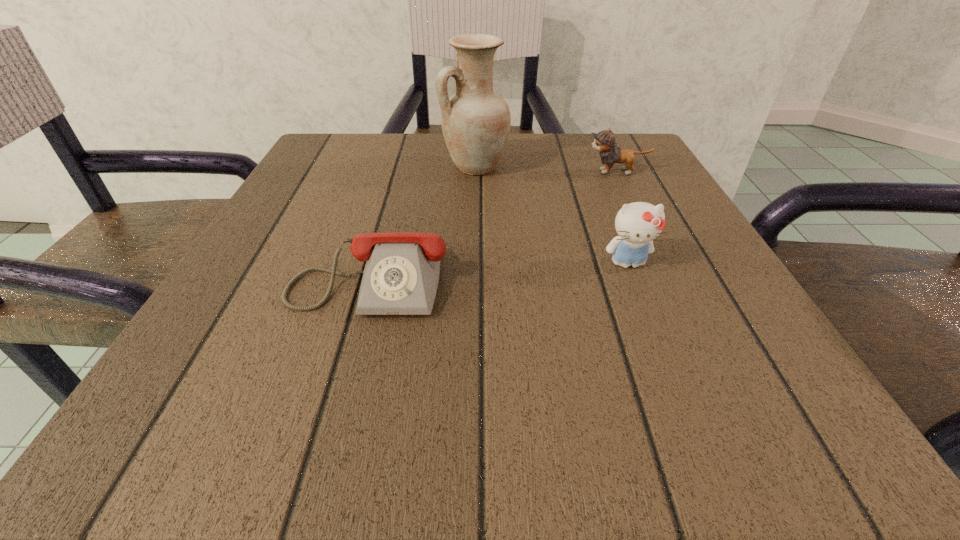
Locate an element on the screen. This screenshot has height=540, width=960. blank space located 0.400m on the front-facing side of the shorter kitten is located at coordinates (388, 172).

Image resolution: width=960 pixels, height=540 pixels. I want to click on pottery present at the far edge, so click(x=475, y=121).

At what (x,y) coordinates should I click in order to perform the action: click on kitten located at the far edge. Please return your answer as a coordinate pair (x, y). The width and height of the screenshot is (960, 540). Looking at the image, I should click on (604, 141).

Find the location of a particular element. This screenshot has height=540, width=960. object located in the left edge section of the desktop is located at coordinates (401, 275).

Where is `object that is at the far right corner`? object that is at the far right corner is located at coordinates tap(604, 141).

I want to click on vacant space at the far edge of the desktop, so click(434, 136).

In the image, there is a desktop. Where is `vacant space at the near edge`? This screenshot has height=540, width=960. vacant space at the near edge is located at coordinates (338, 400).

Locate an element on the screen. The image size is (960, 540). blank area at the left edge is located at coordinates (354, 232).

The image size is (960, 540). I want to click on free region at the right edge, so click(683, 202).

Where is `free point at the far left corner`? This screenshot has height=540, width=960. free point at the far left corner is located at coordinates (330, 167).